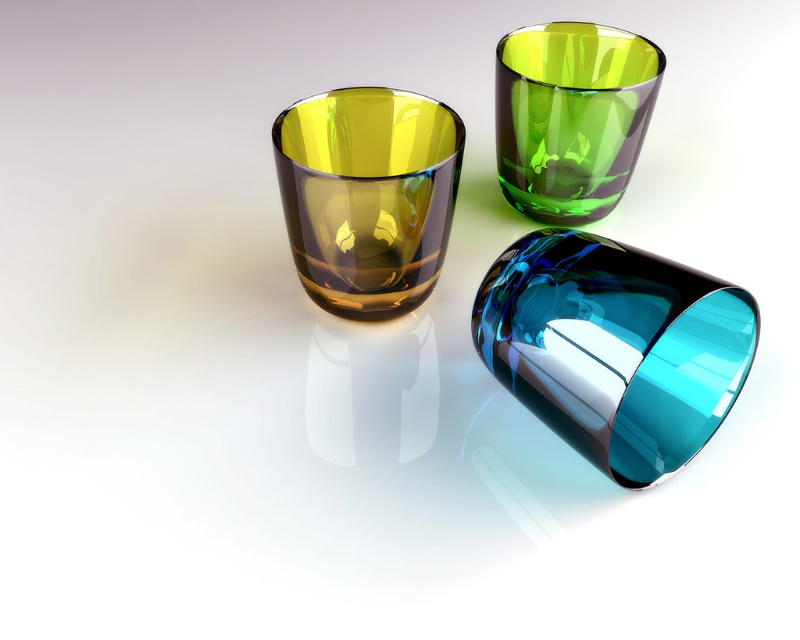
Can you confirm if amber glass at center is positioned to the right of green translucent glass at upper center?

In fact, amber glass at center is to the left of green translucent glass at upper center.

Who is lower down, amber glass at center or green translucent glass at upper center?

amber glass at center is lower down.

Between point (448, 205) and point (540, 97), which one is positioned behind?

Point (540, 97)

At what (x,y) coordinates should I click in order to perform the action: click on amber glass at center. Please return your answer as a coordinate pair (x, y). Looking at the image, I should click on coord(368,195).

Does translucent blue glass at lower right appear on the right side of amber glass at center?

Indeed, translucent blue glass at lower right is positioned on the right side of amber glass at center.

Between point (654, 404) and point (390, 260), which one is positioned in front?

Point (654, 404)

Find the location of `translucent blue glass at lower right`. translucent blue glass at lower right is located at coordinates (614, 348).

Which is behind, point (598, 420) or point (644, 116)?

Point (644, 116)

Is point (538, 410) farther from camera compared to point (584, 35)?

No, (538, 410) is closer to viewer.

You are a GUI agent. You are given a task and a screenshot of the screen. Output one action in this format:
    pyautogui.click(x=<x>, y=<y>)
    Task: Click on the translucent blue glass at lower right
    This screenshot has width=800, height=640.
    Given the screenshot: What is the action you would take?
    pyautogui.click(x=614, y=348)